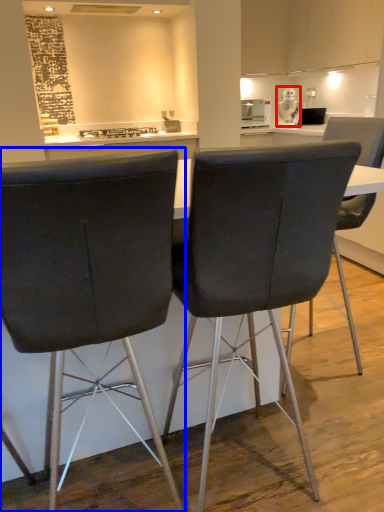
Question: Which point is further to the camera, appliance (highlighted by a red box) or chair (highlighted by a blue box)?

Choices:
 (A) appliance
 (B) chair

Answer: (A)